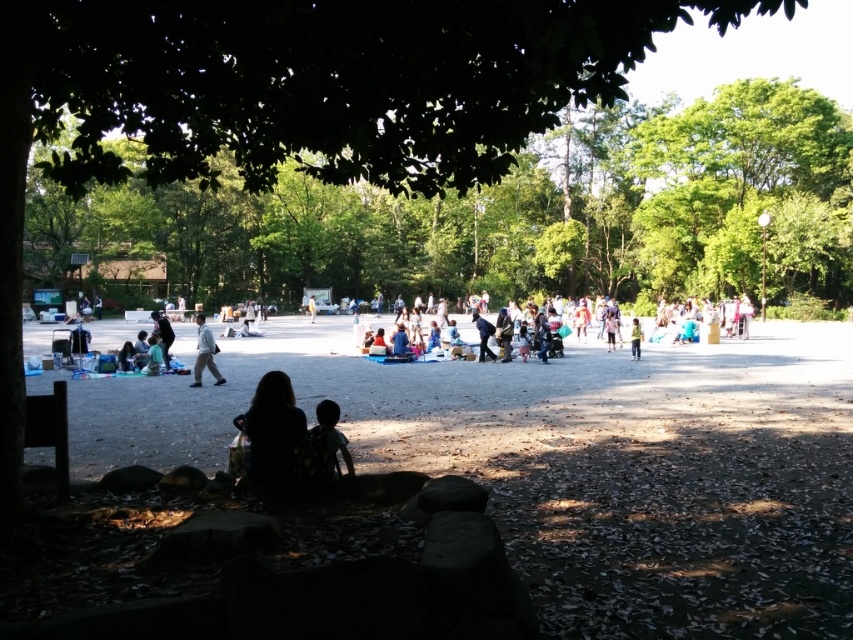
Does point (341, 445) come in front of point (148, 340)?

Yes, it is in front of point (148, 340).

Does dark hair at center have a greater height compared to light blue fabric at center?

Incorrect, dark hair at center's height is not larger of light blue fabric at center's.

You are a GUI agent. You are given a task and a screenshot of the screen. Output one action in this format:
    pyautogui.click(x=<x>, y=<y>)
    Task: Click on the dark hair at center
    This screenshot has height=640, width=853.
    Given the screenshot: What is the action you would take?
    pyautogui.click(x=329, y=442)

Between light brown fabric jacket at center and yellow fabric at center, which one has less height?

Standing shorter between the two is light brown fabric jacket at center.

Can you confirm if light brown fabric jacket at center is wider than yellow fabric at center?

No.

Does point (639, 356) lie in front of point (311, 294)?

Yes, point (639, 356) is closer to viewer.

Find the location of a particular element. This screenshot has width=853, height=640. light brown fabric jacket at center is located at coordinates (635, 339).

Can you confirm if white cotton shirt at center is positioned to the left of light blue fabric at center?

Correct, you'll find white cotton shirt at center to the left of light blue fabric at center.

The width and height of the screenshot is (853, 640). I want to click on white cotton shirt at center, so click(204, 353).